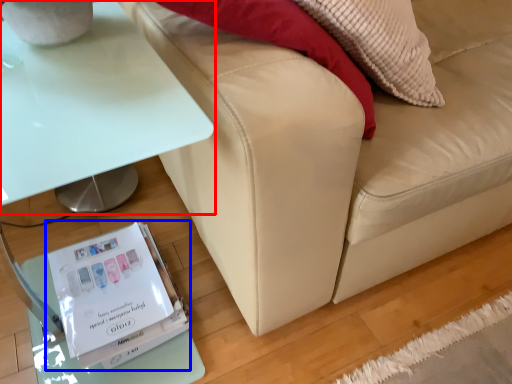
Question: Which object is further to the camera taking this photo, table (highlighted by a red box) or paperback book (highlighted by a blue box)?

Choices:
 (A) table
 (B) paperback book

Answer: (B)